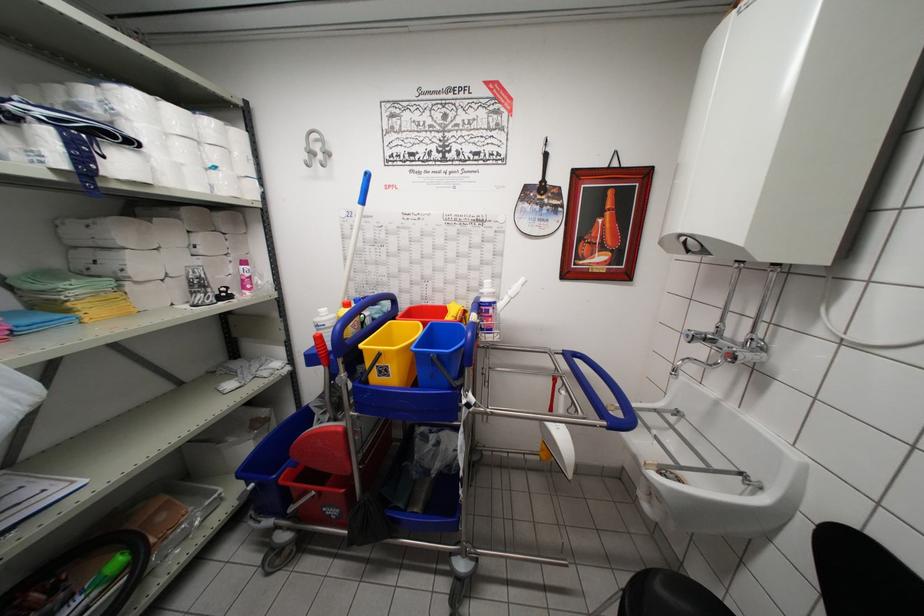
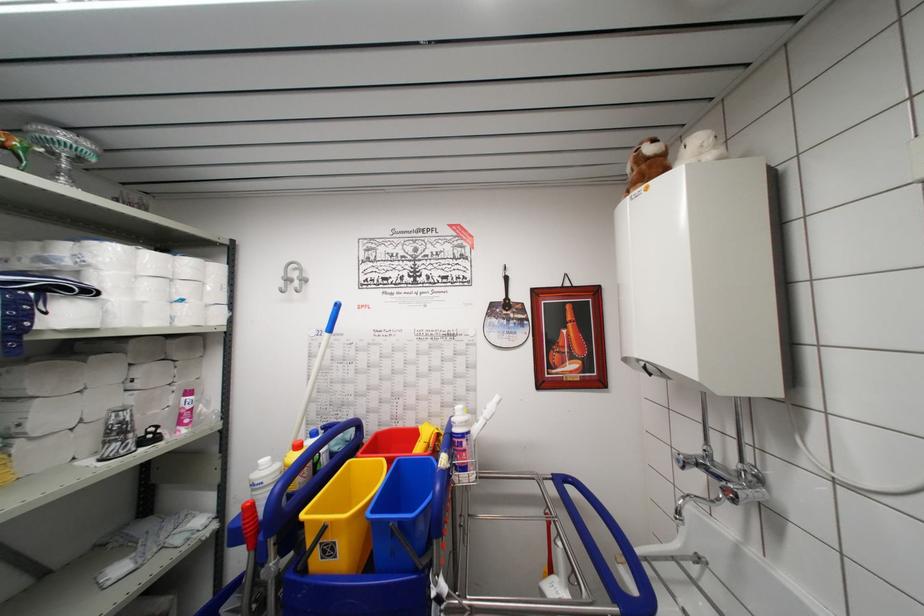
Locate, in the second image, the point that corresponds to (x=186, y=169) in the first image.

(149, 307)